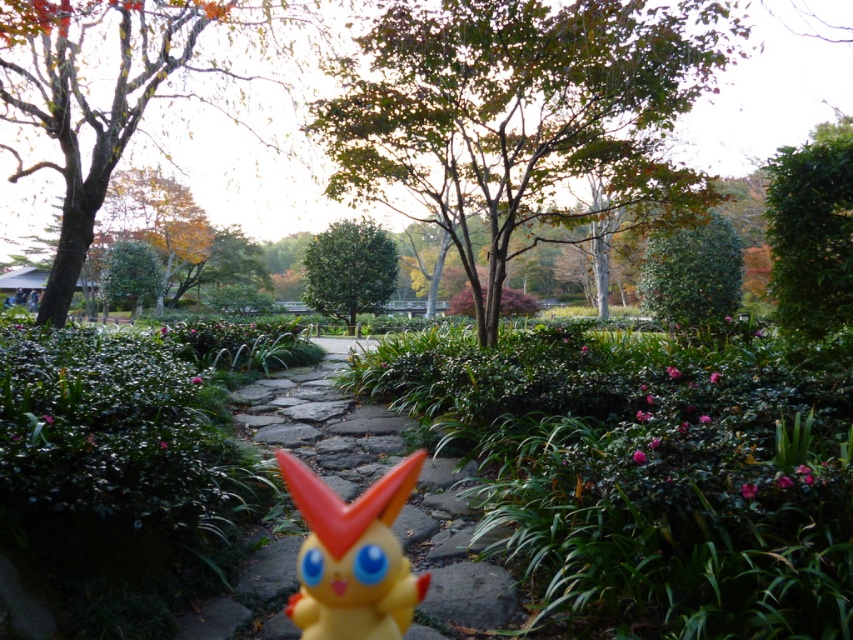
Between point (306, 582) and point (349, 260), which one is positioned in front?

Positioned in front is point (306, 582).

How much distance is there between yellow plastic toy at center and green matte tree at center?

yellow plastic toy at center is 75.36 feet away from green matte tree at center.

Is point (354, 513) in front of point (367, 273)?

Yes, it is.

Image resolution: width=853 pixels, height=640 pixels. What are the coordinates of `yellow plastic toy at center` in the screenshot? It's located at (352, 556).

Who is lower down, green leafy tree at center or green leafy tree at upper right?

green leafy tree at upper right is lower down.

Is green leafy tree at center shorter than green leafy tree at upper right?

No, green leafy tree at center is not shorter than green leafy tree at upper right.

The width and height of the screenshot is (853, 640). What are the coordinates of `green leafy tree at center` in the screenshot? It's located at [x=521, y=116].

Can you confirm if green leafy tree at center is positioned to the right of green matte tree at center?

Yes, green leafy tree at center is to the right of green matte tree at center.

Between green leafy tree at center and green matte tree at center, which one has less height?

green matte tree at center

Who is more distant from viewer, (579,152) or (323,259)?

The point (323,259) is more distant.

Where is `green leafy tree at center`? The width and height of the screenshot is (853, 640). green leafy tree at center is located at coordinates (521, 116).